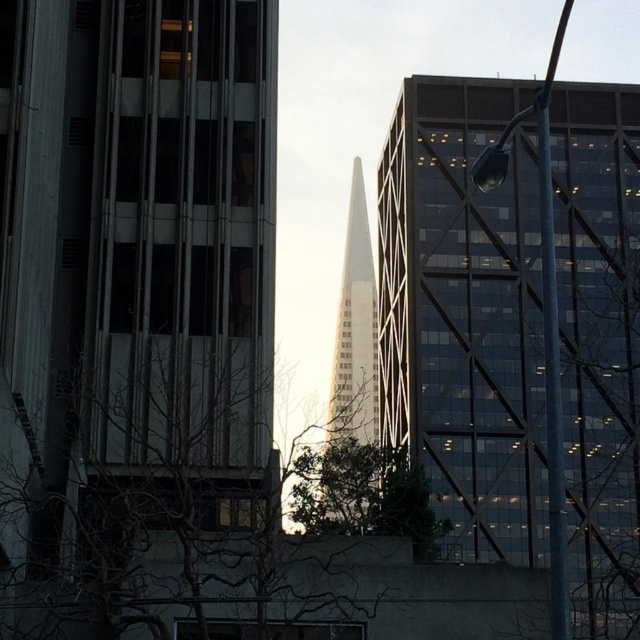
Does glassy reflective skyscraper at center have a greater width compared to glassy white skyscraper at center?

Yes, glassy reflective skyscraper at center is wider than glassy white skyscraper at center.

Can you confirm if glassy reflective skyscraper at center is bigger than glassy white skyscraper at center?

Yes, glassy reflective skyscraper at center is bigger than glassy white skyscraper at center.

Where is `glassy reflective skyscraper at center`? This screenshot has width=640, height=640. glassy reflective skyscraper at center is located at coordinates (465, 314).

Identify the location of glassy reflective skyscraper at center. This screenshot has width=640, height=640. (465, 314).